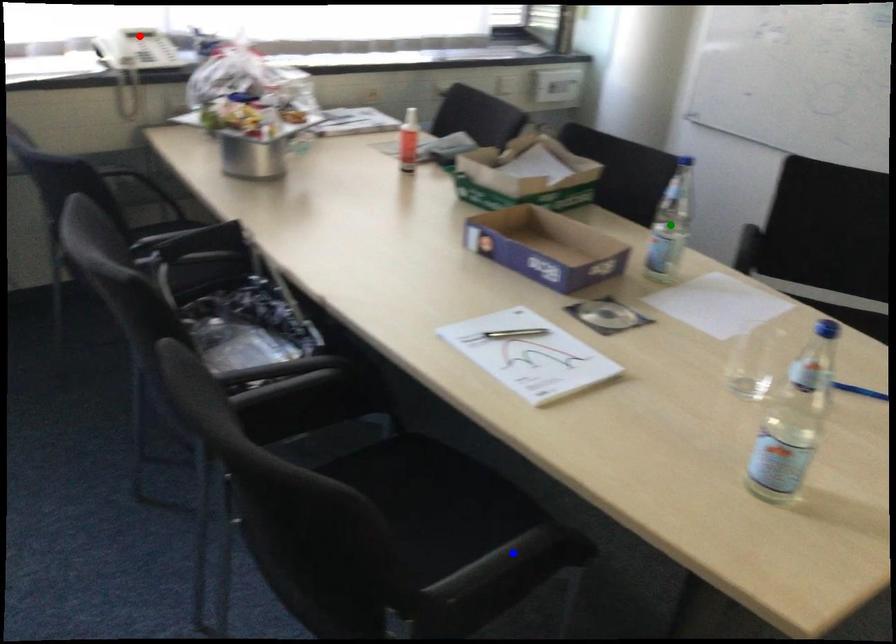
Order these from nearest to farthest:
green point | blue point | red point

blue point, green point, red point